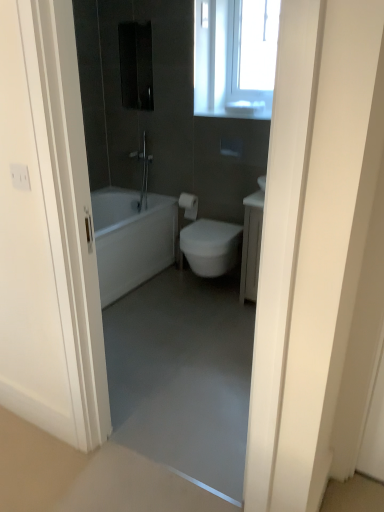
Question: Is transparent plastic window at upper right in front of or behind white matte toilet paper at center in the image?

Choices:
 (A) front
 (B) behind

Answer: (A)

Question: Based on their positions, is transparent plastic window at upper right located to the left or right of white matte toilet paper at center?

Choices:
 (A) left
 (B) right

Answer: (B)

Question: Estimate the real-world distances between objects in this image. Which object is closer to the white glossy bidet at center?

Choices:
 (A) white glossy door at upper center
 (B) matte silver shower at center
 (C) transparent plastic window at upper right
 (D) white matte toilet paper at center
 (E) white glossy sink at upper center

Answer: (D)

Question: Estimate the real-world distances between objects in this image. Which object is closer to the transparent plastic window at upper right?

Choices:
 (A) white matte toilet paper at center
 (B) white glossy bidet at center
 (C) white glossy sink at upper center
 (D) white glossy door at upper center
 (E) matte silver shower at center

Answer: (C)